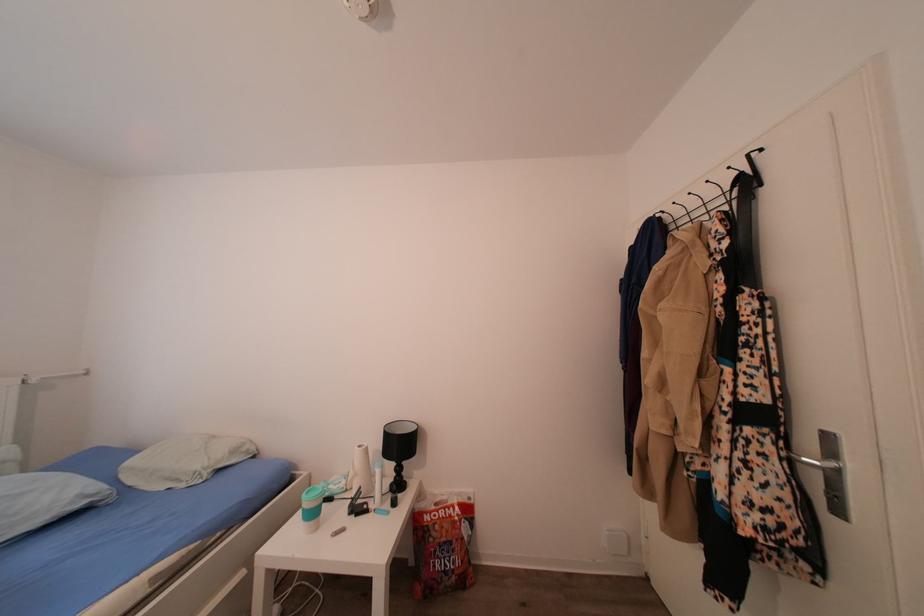
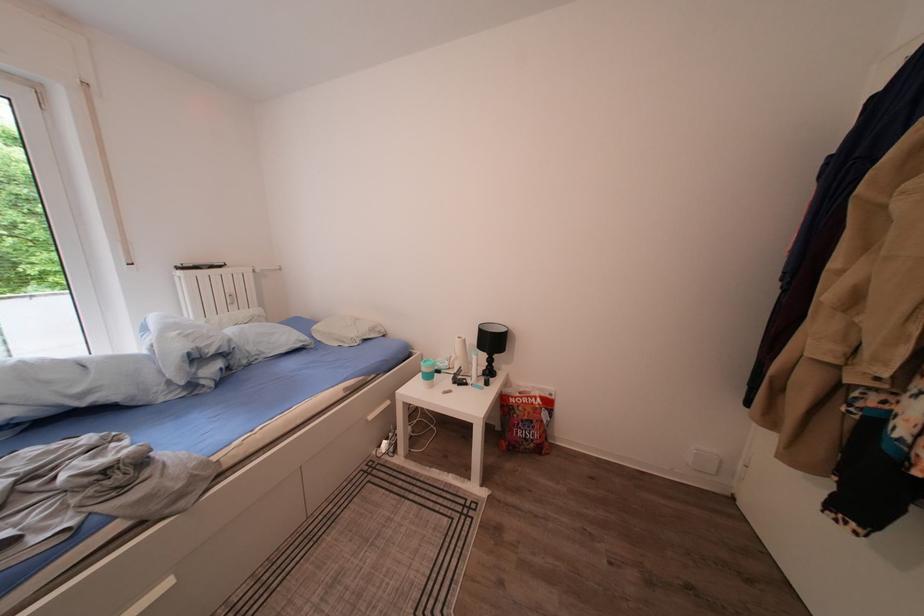
Where in the second image is the point corresponding to (x=420, y=568) from the first image?

(506, 432)